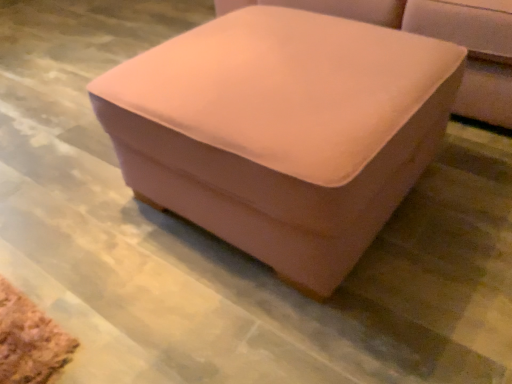
Question: From a real-world perspective, is matte pink ottoman at center over pink velvet ottoman at center?

Choices:
 (A) yes
 (B) no

Answer: (A)

Question: Considering the relative sizes of matte pink ottoman at center and pink velvet ottoman at center in the image provided, is matte pink ottoman at center thinner than pink velvet ottoman at center?

Choices:
 (A) yes
 (B) no

Answer: (B)

Question: Is pink velvet ottoman at center completely or partially inside matte pink ottoman at center?

Choices:
 (A) yes
 (B) no

Answer: (B)

Question: From the image's perspective, does matte pink ottoman at center appear higher than pink velvet ottoman at center?

Choices:
 (A) no
 (B) yes

Answer: (B)

Question: Does matte pink ottoman at center appear on the left side of pink velvet ottoman at center?

Choices:
 (A) no
 (B) yes

Answer: (A)

Question: Can you confirm if matte pink ottoman at center is smaller than pink velvet ottoman at center?

Choices:
 (A) no
 (B) yes

Answer: (A)

Question: Is pink velvet ottoman at center thinner than matte pink ottoman at center?

Choices:
 (A) yes
 (B) no

Answer: (A)

Question: Would you say pink velvet ottoman at center is a long distance from matte pink ottoman at center?

Choices:
 (A) no
 (B) yes

Answer: (A)

Question: Could matte pink ottoman at center be considered to be inside pink velvet ottoman at center?

Choices:
 (A) yes
 (B) no

Answer: (B)

Question: From a real-world perspective, is pink velvet ottoman at center beneath matte pink ottoman at center?

Choices:
 (A) no
 (B) yes

Answer: (B)

Question: Is pink velvet ottoman at center positioned with its back to matte pink ottoman at center?

Choices:
 (A) yes
 (B) no

Answer: (A)

Question: Considering the relative positions of pink velvet ottoman at center and matte pink ottoman at center in the image provided, is pink velvet ottoman at center in front of matte pink ottoman at center?

Choices:
 (A) yes
 (B) no

Answer: (A)

Question: Is pink velvet ottoman at center inside or outside of matte pink ottoman at center?

Choices:
 (A) outside
 (B) inside

Answer: (A)